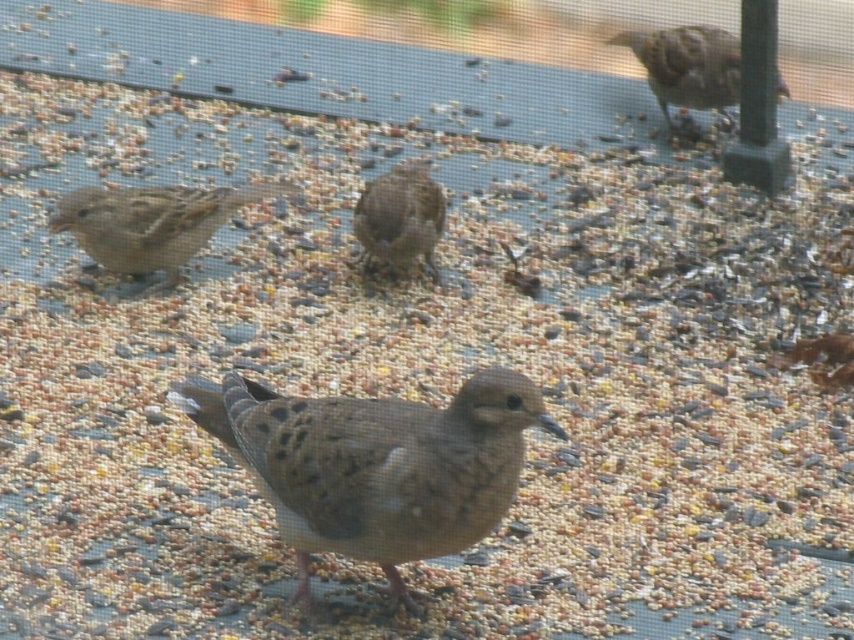
Question: In this image, where is brown speckled sparrow at left located relative to brown speckled sparrow at upper right?

Choices:
 (A) below
 (B) above

Answer: (A)

Question: Which of these objects is positioned closest to the brown speckled pigeon at center?

Choices:
 (A) brown speckled sparrow at left
 (B) brown speckled sparrow at center

Answer: (A)

Question: From the image, what is the correct spatial relationship of brown speckled sparrow at center in relation to brown speckled sparrow at upper right?

Choices:
 (A) left
 (B) right

Answer: (A)

Question: In this image, where is brown speckled sparrow at left located relative to brown speckled sparrow at upper right?

Choices:
 (A) above
 (B) below

Answer: (B)

Question: Which point is closer to the camera?

Choices:
 (A) brown speckled sparrow at upper right
 (B) brown speckled pigeon at center
 (C) brown speckled sparrow at center

Answer: (C)

Question: Which of these objects is positioned farthest from the brown speckled sparrow at left?

Choices:
 (A) brown speckled sparrow at center
 (B) brown speckled pigeon at center

Answer: (A)